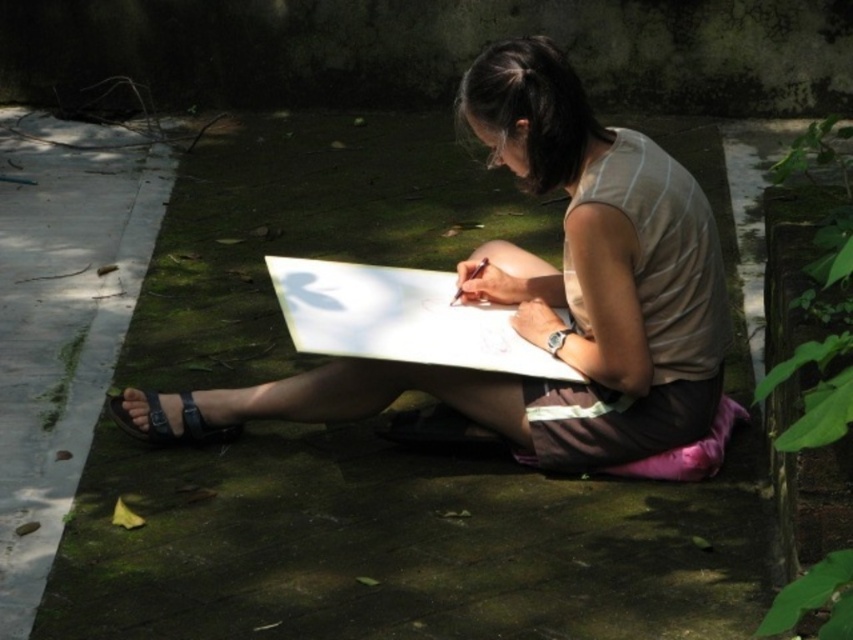
Question: Is matte white paper at center further to camera compared to black leather sandal at lower left?

Choices:
 (A) no
 (B) yes

Answer: (A)

Question: Does matte white paper at center have a smaller size compared to black leather sandal at lower left?

Choices:
 (A) no
 (B) yes

Answer: (A)

Question: Which of the following is the closest to the observer?

Choices:
 (A) (599, 307)
 (B) (190, 426)

Answer: (A)

Question: Which point is farther from the camera taking this photo?

Choices:
 (A) (177, 440)
 (B) (537, 164)

Answer: (A)

Question: Is matte white paper at center bigger than black leather sandal at lower left?

Choices:
 (A) yes
 (B) no

Answer: (A)